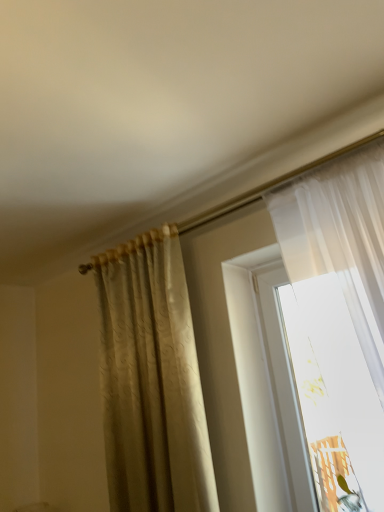
Image resolution: width=384 pixels, height=512 pixels. What do you see at coordinates (151, 379) in the screenshot?
I see `silky beige curtain at center` at bounding box center [151, 379].

This screenshot has width=384, height=512. Identify the location of silky beige curtain at center. (151, 379).

Identify the location of silky beige curtain at center. (151, 379).